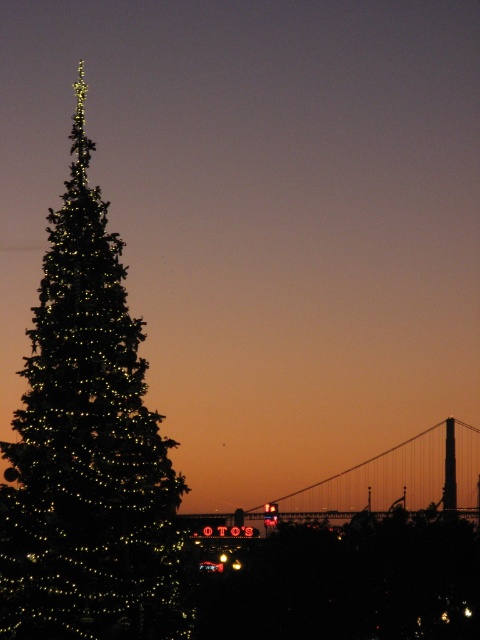
You are standing in this evening scene and want to take a photo of both the illuminated matte green christmas tree at left and the metallic bridge at center. Since you can only focus on one object at a time, which one should you position closer to the camera to ensure both are in the frame?

The illuminated matte green christmas tree at left is positioned on the left side of the metallic bridge at center. To ensure both are in the frame, you should position the metallic bridge at center closer to the camera because it is further away from the camera than the tree.

Consider the image. You are a drone operator tasked with capturing aerial footage of the illuminated matte green christmas tree at left and the metallic bridge at center. Your drone has a maximum flight range of 60 meters. Can your drone travel from the christmas tree to the bridge without needing to return to its starting point for a recharge?

The distance between the illuminated matte green christmas tree at left and the metallic bridge at center is 66.18 meters. Since the drone can only fly up to 60 meters before needing to recharge, it cannot make the trip without returning to recharge.

You are standing at the point labeled point (87, 449) in the image. What object are you facing?

You are facing the illuminated matte green christmas tree at left.